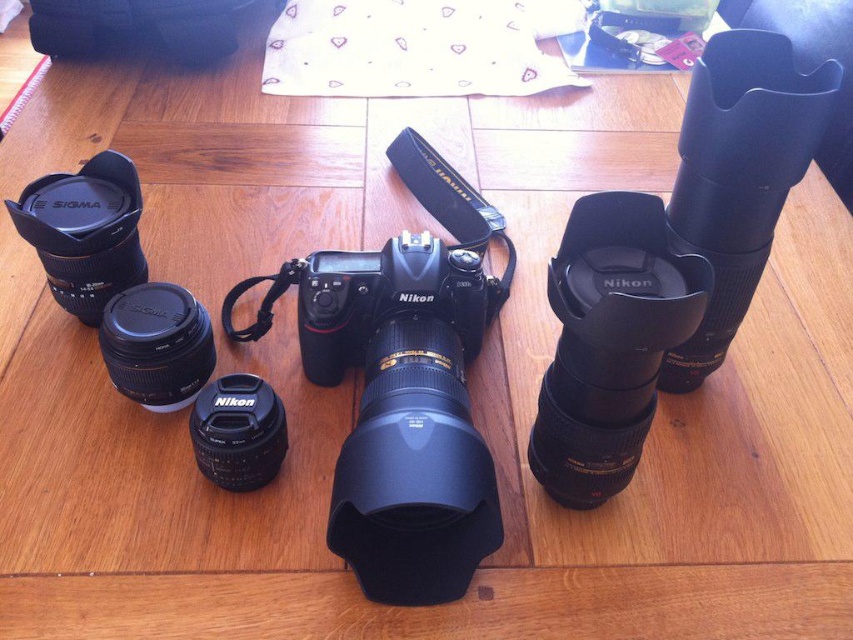
Who is taller, matte black lens at left or matte black lens at lower left?

With more height is matte black lens at left.

Consider the image. Between matte black lens at left and matte black lens at lower left, which one has less height?

Standing shorter between the two is matte black lens at lower left.

Between point (61, 285) and point (119, 368), which one is positioned in front?

Point (119, 368)

Where is `matte black lens at left`? matte black lens at left is located at coordinates (85, 230).

Locate an element on the screen. black rubberized lens at upper right is located at coordinates (671, 262).

Which is behind, point (782, 179) or point (224, 440)?

Positioned behind is point (224, 440).

Does point (605, 438) lie in front of point (239, 433)?

Yes, it is.

Find the location of `black rubberized lens at upper right`. black rubberized lens at upper right is located at coordinates (671, 262).

Which is more to the left, matte black lens at left or black rubber lens cap at lower center?

matte black lens at left

The image size is (853, 640). Identify the location of matte black lens at left. (85, 230).

Identify the location of matte black lens at left. Image resolution: width=853 pixels, height=640 pixels. [x=85, y=230].